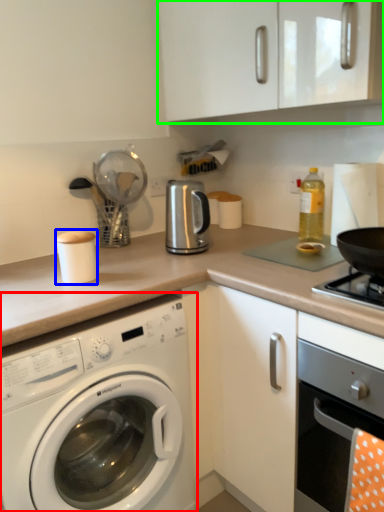
Question: Estimate the real-world distances between objects in this image. Which object is closer to washing machine (highlighted by a red box), appliance (highlighted by a blue box) or cabinetry (highlighted by a green box)?

Choices:
 (A) appliance
 (B) cabinetry

Answer: (A)